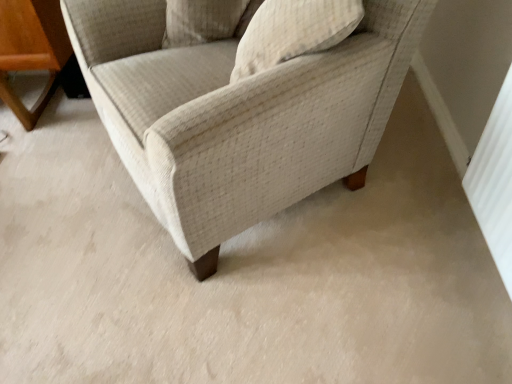
The height and width of the screenshot is (384, 512). Identify the location of free spot in front of beige fabric chair at center. (273, 311).